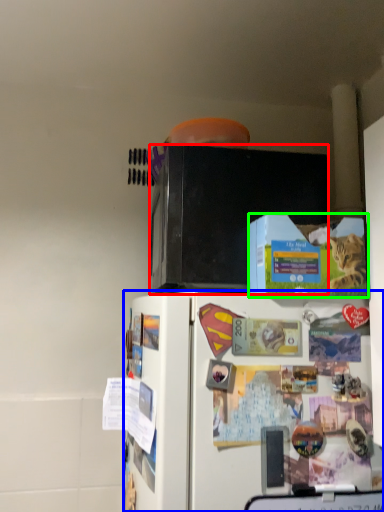
Question: Estimate the real-world distances between objects in this image. Which object is closer to microwave oven (highlighted by a red box), refrigerator (highlighted by a blue box) or box (highlighted by a green box)?

Choices:
 (A) refrigerator
 (B) box

Answer: (B)